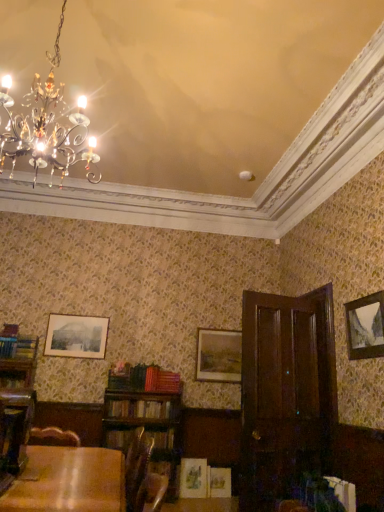
Locate an element on the screen. Image resolution: width=384 pixels, height=512 pixels. wooden picture frame at right, which is the 1th picture frame in front-to-back order is located at coordinates (365, 327).

Describe the element at coordinates (286, 393) in the screenshot. Image resolution: width=384 pixels, height=512 pixels. I see `dark wood armoire at right` at that location.

This screenshot has height=512, width=384. Identify the location of matte gold picture frame at center, which ranks as the second picture frame in left-to-right order. (219, 356).

Describe the element at coordinates (12, 381) in the screenshot. I see `hardcover book at lower left, marked as the third book in a front-to-back arrangement` at that location.

The width and height of the screenshot is (384, 512). I want to click on wooden bookshelf at center, the fourth book viewed from the front, so click(141, 408).

Where is `wooden picture frame at right, the third picture frame in the back-to-front sequence`? wooden picture frame at right, the third picture frame in the back-to-front sequence is located at coordinates (365, 327).

Which of these two, matte black picture frame at upper left, which ranks as the third picture frame in right-to-left order, or wooden picture frame at right, the third picture frame in the back-to-front sequence, stands taller?

wooden picture frame at right, the third picture frame in the back-to-front sequence.

This screenshot has width=384, height=512. I want to click on picture frame lying in front of the matte black picture frame at upper left, acting as the first picture frame starting from the left, so click(x=365, y=327).

Considering the relative sizes of matte black picture frame at upper left, which ranks as the third picture frame in right-to-left order, and wooden picture frame at right, the third picture frame in the back-to-front sequence, in the image provided, is matte black picture frame at upper left, which ranks as the third picture frame in right-to-left order, smaller than wooden picture frame at right, the third picture frame in the back-to-front sequence,?

Correct, matte black picture frame at upper left, which ranks as the third picture frame in right-to-left order, occupies less space than wooden picture frame at right, the third picture frame in the back-to-front sequence.

Could you measure the distance between matte black picture frame at upper left, placed as the 2th picture frame when sorted from back to front, and wooden picture frame at right, acting as the 1th picture frame starting from the right?

The distance of matte black picture frame at upper left, placed as the 2th picture frame when sorted from back to front, from wooden picture frame at right, acting as the 1th picture frame starting from the right, is 2.89 meters.

Can you confirm if matte black picture frame at upper left, placed as the 2th picture frame when sorted from back to front, is positioned to the left of wooden bookshelf at center, the 2th book in the right-to-left sequence?

Indeed, matte black picture frame at upper left, placed as the 2th picture frame when sorted from back to front, is positioned on the left side of wooden bookshelf at center, the 2th book in the right-to-left sequence.

From a real-world perspective, which is physically above, matte black picture frame at upper left, acting as the first picture frame starting from the left, or wooden bookshelf at center, the fourth book viewed from the front?

In real-world perspective, matte black picture frame at upper left, acting as the first picture frame starting from the left, is above.

Does point (96, 344) lie in front of point (156, 402)?

That is False.

Which is in front, matte black picture frame at upper left, which ranks as the second picture frame in front-to-back order, or matte gold picture frame at center, positioned as the first picture frame in back-to-front order?

matte black picture frame at upper left, which ranks as the second picture frame in front-to-back order, is more forward.

Does matte black picture frame at upper left, acting as the first picture frame starting from the left, turn towards matte gold picture frame at center, arranged as the third picture frame when viewed from the front?

No, matte black picture frame at upper left, acting as the first picture frame starting from the left, is not oriented towards matte gold picture frame at center, arranged as the third picture frame when viewed from the front.

Is matte black picture frame at upper left, which ranks as the second picture frame in front-to-back order, to the right of matte gold picture frame at center, the second picture frame in the right-to-left sequence, from the viewer's perspective?

No.

In the image, is matte black picture frame at upper left, which ranks as the third picture frame in right-to-left order, on the left side or the right side of wooden table at lower left?

In the image, matte black picture frame at upper left, which ranks as the third picture frame in right-to-left order, appears on the left side of wooden table at lower left.

Which of these two, matte black picture frame at upper left, acting as the first picture frame starting from the left, or wooden table at lower left, is wider?

With larger width is wooden table at lower left.

Considering the points (97, 327) and (52, 471), which point is in front, point (97, 327) or point (52, 471)?

The point (52, 471) is more forward.

Considering the sizes of objects matte black picture frame at upper left, placed as the 2th picture frame when sorted from back to front, and wooden table at lower left in the image provided, who is taller, matte black picture frame at upper left, placed as the 2th picture frame when sorted from back to front, or wooden table at lower left?

matte black picture frame at upper left, placed as the 2th picture frame when sorted from back to front, is taller.

In terms of height, does hardcover book at center, which is the third book in back-to-front order, look taller or shorter compared to white paper book at lower right, which is the 4th book in left-to-right order?

Clearly, hardcover book at center, which is the third book in back-to-front order, is shorter compared to white paper book at lower right, which is the 4th book in left-to-right order.

From the image's perspective, would you say hardcover book at center, acting as the second book starting from the left, is positioned over white paper book at lower right, which is the 4th book in left-to-right order?

Actually, hardcover book at center, acting as the second book starting from the left, appears below white paper book at lower right, which is the 4th book in left-to-right order, in the image.

In the image, is hardcover book at center, the 3th book viewed from the right, positioned in front of or behind white paper book at lower right, arranged as the fourth book when viewed from the back?

hardcover book at center, the 3th book viewed from the right, is behind white paper book at lower right, arranged as the fourth book when viewed from the back.

Based on the photo, how many degrees apart are the facing directions of hardcover book at center, acting as the second book starting from the left, and white paper book at lower right, which is the 4th book in left-to-right order?

The angular difference between hardcover book at center, acting as the second book starting from the left, and white paper book at lower right, which is the 4th book in left-to-right order, is 86.8 degrees.

Are wooden table at lower left and hardcover book at center, the 3th book viewed from the right, far apart?

That's not correct — wooden table at lower left is a little close to hardcover book at center, the 3th book viewed from the right.

Considering the sizes of wooden table at lower left and hardcover book at center, positioned as the 2th book in front-to-back order, in the image, is wooden table at lower left taller or shorter than hardcover book at center, positioned as the 2th book in front-to-back order,?

wooden table at lower left is taller than hardcover book at center, positioned as the 2th book in front-to-back order.

Which is more to the right, wooden table at lower left or hardcover book at center, positioned as the 2th book in front-to-back order?

wooden table at lower left.

Is the position of wooden table at lower left more distant than that of hardcover book at center, acting as the second book starting from the left?

No, wooden table at lower left is closer to the camera.

What's the angular difference between hardcover book at center, the 3th book viewed from the right, and hardcover book at lower left, which is the 1th book from left to right,'s facing directions?

The angle between the facing direction of hardcover book at center, the 3th book viewed from the right, and the facing direction of hardcover book at lower left, which is the 1th book from left to right, is 0.00126 degrees.

From the picture: Between hardcover book at center, acting as the second book starting from the left, and hardcover book at lower left, which is counted as the 2th book, starting from the back, which one has larger size?

hardcover book at center, acting as the second book starting from the left, is bigger.

From the image's perspective, is hardcover book at center, positioned as the 2th book in front-to-back order, located above hardcover book at lower left, which is the 1th book from left to right?

No.

Can you confirm if hardcover book at center, positioned as the 2th book in front-to-back order, is shorter than hardcover book at lower left, which is the 1th book from left to right?

No, hardcover book at center, positioned as the 2th book in front-to-back order, is not shorter than hardcover book at lower left, which is the 1th book from left to right.

Find the location of `picture frame that is the 1st one when counting downward from the wooden picture frame at right, which is the 1th picture frame in front-to-back order (from the image's perspective)`. picture frame that is the 1st one when counting downward from the wooden picture frame at right, which is the 1th picture frame in front-to-back order (from the image's perspective) is located at coordinates (76, 336).

From a real-world perspective, which book is the 2nd one underneath the matte black picture frame at upper left, acting as the first picture frame starting from the left? Please provide its 2D coordinates.

[(141, 408)]

Looking at the image, which one is located further to hardcover book at lower left, the 4th book positioned from the right, matte black picture frame at upper left, acting as the first picture frame starting from the left, or wooden table at lower left?

Based on the image, matte black picture frame at upper left, acting as the first picture frame starting from the left, appears to be further to hardcover book at lower left, the 4th book positioned from the right.

Looking at the image, which one is located further to hardcover book at lower left, marked as the third book in a front-to-back arrangement, wooden table at lower left or wooden bookshelf at center, which is the 1th book in back-to-front order?

Based on the image, wooden table at lower left appears to be further to hardcover book at lower left, marked as the third book in a front-to-back arrangement.

Based on their spatial positions, is hardcover book at lower left, which is the 1th book from left to right, or wooden bookshelf at center, positioned as the third book in left-to-right order, further from hardcover book at center, acting as the second book starting from the left?

hardcover book at lower left, which is the 1th book from left to right, lies further to hardcover book at center, acting as the second book starting from the left, than the other object.

Considering their positions, is hardcover book at center, acting as the second book starting from the left, positioned further to hardcover book at lower left, which is counted as the 2th book, starting from the back, than matte gold picture frame at center, positioned as the first picture frame in back-to-front order?

matte gold picture frame at center, positioned as the first picture frame in back-to-front order.

Looking at the image, which one is located further to white paper book at lower right, arranged as the fourth book when viewed from the back, wooden table at lower left or wooden bookshelf at center, positioned as the third book in left-to-right order?

Based on the image, wooden table at lower left appears to be further to white paper book at lower right, arranged as the fourth book when viewed from the back.

Estimate the real-world distances between objects in this image. Which object is closer to wooden bookshelf at center, positioned as the third book in left-to-right order, hardcover book at lower left, marked as the third book in a front-to-back arrangement, or wooden picture frame at right, the third picture frame in the back-to-front sequence?

hardcover book at lower left, marked as the third book in a front-to-back arrangement, is closer to wooden bookshelf at center, positioned as the third book in left-to-right order.

When comparing their distances from hardcover book at lower left, which is counted as the 2th book, starting from the back, does matte gold picture frame at center, arranged as the third picture frame when viewed from the front, or hardcover book at center, positioned as the 2th book in front-to-back order, seem closer?

hardcover book at center, positioned as the 2th book in front-to-back order, lies closer to hardcover book at lower left, which is counted as the 2th book, starting from the back, than the other object.

Which object lies nearer to the anchor point wooden picture frame at right, which is the 1th picture frame in front-to-back order, wooden table at lower left or dark wood armoire at right?

Based on the image, dark wood armoire at right appears to be nearer to wooden picture frame at right, which is the 1th picture frame in front-to-back order.

Identify the location of armoire between wooden bookshelf at center, the 2th book in the right-to-left sequence, and wooden picture frame at right, the 3th picture frame in the left-to-right sequence, in the horizontal direction. The image size is (384, 512). (286, 393).

Locate an element on the screen. The image size is (384, 512). book located between wooden bookshelf at center, the 2th book in the right-to-left sequence, and wooden picture frame at right, acting as the 1th picture frame starting from the right, in the left-right direction is located at coordinates (343, 492).

Where is `book between wooden table at lower left and wooden picture frame at right, the 3th picture frame in the left-to-right sequence, from left to right`? This screenshot has height=512, width=384. book between wooden table at lower left and wooden picture frame at right, the 3th picture frame in the left-to-right sequence, from left to right is located at coordinates (343, 492).

Locate an element on the screen. Image resolution: width=384 pixels, height=512 pixels. book situated between hardcover book at center, the 3th book viewed from the right, and matte gold picture frame at center, positioned as the first picture frame in back-to-front order, from left to right is located at coordinates (141, 408).